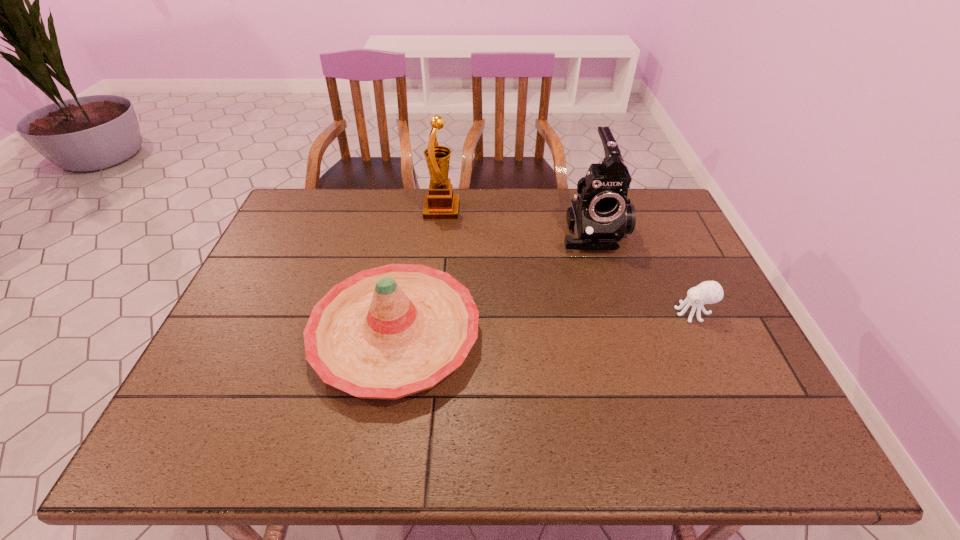
Find the location of a particular element. The image size is (960, 540). vacant region between the camcorder and the shortest object is located at coordinates (643, 272).

In order to click on free area in between the shortest object and the third tallest object in this screenshot , I will do `click(544, 324)`.

The width and height of the screenshot is (960, 540). I want to click on free space between the award and the third object from left to right, so click(517, 220).

Find the location of a particular element. This screenshot has width=960, height=540. vacant space that is in between the octopus and the sombrero is located at coordinates (544, 324).

Where is `free area in between the award and the second object from right to left`? free area in between the award and the second object from right to left is located at coordinates (517, 220).

At what (x,y) coordinates should I click in order to perform the action: click on the second closest object to the award. Please return your answer as a coordinate pair (x, y). The image size is (960, 540). Looking at the image, I should click on (599, 216).

Point out which object is positioned as the third nearest to the award. Please provide its 2D coordinates. Your answer should be formatted as a tuple, i.e. [(x, y)], where the tuple contains the x and y coordinates of a point satisfying the conditions above.

[(708, 292)]